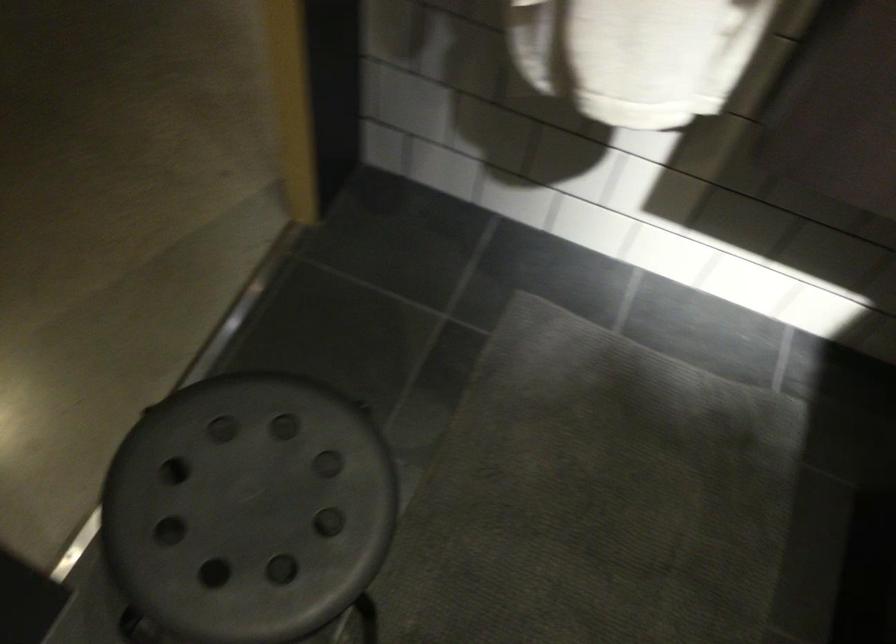
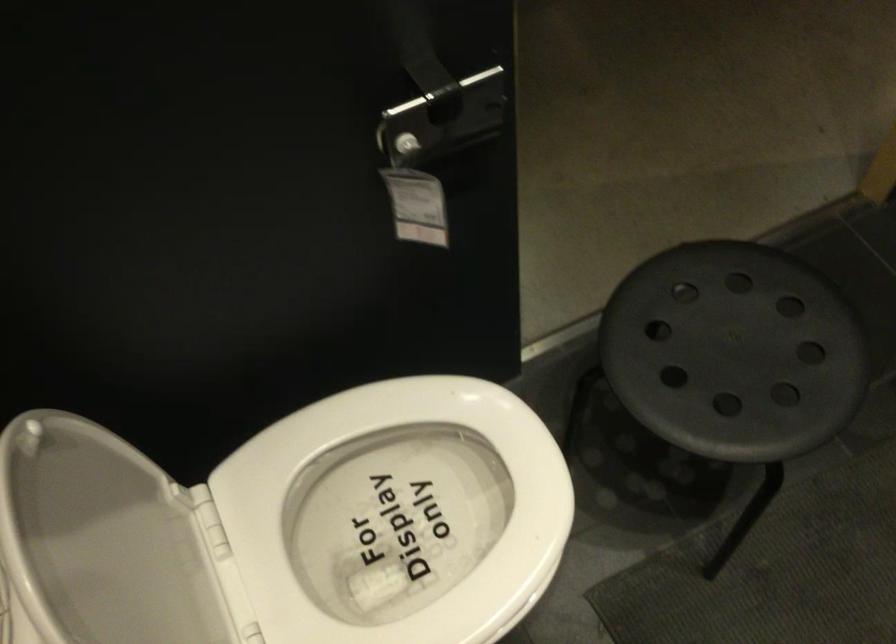
Where in the second image is the point corresponding to point 261,486 from the first image?

(734, 351)